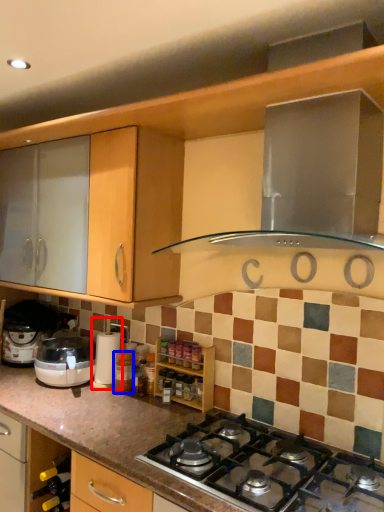
Question: Which point is closer to the camera, coffee machine (highlighted by a red box) or bottle (highlighted by a blue box)?

Choices:
 (A) coffee machine
 (B) bottle

Answer: (B)